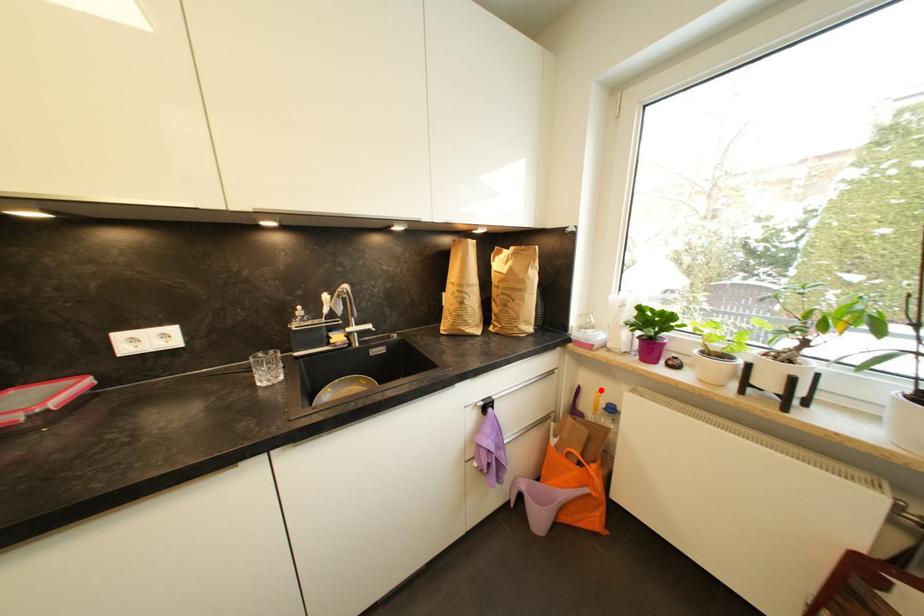
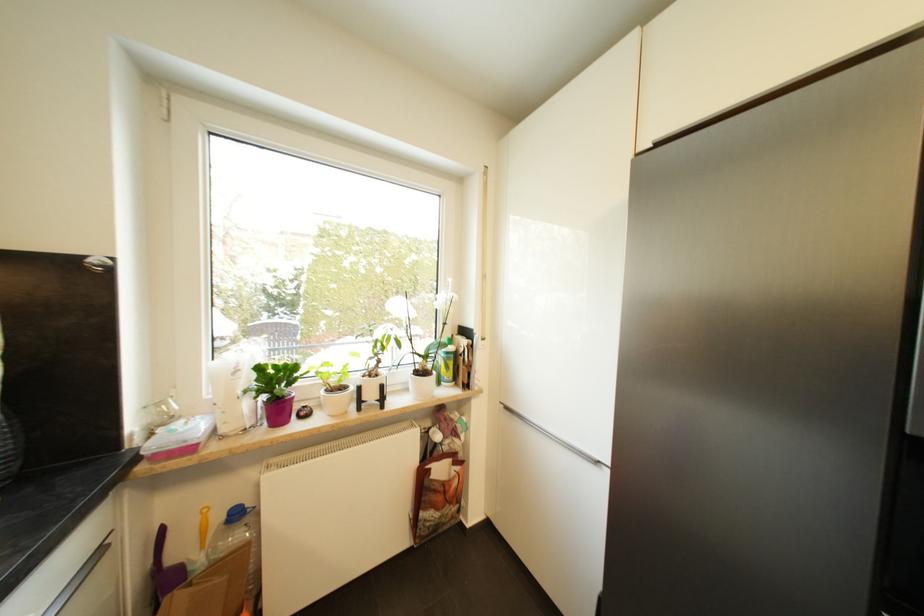
Where in the second image is the point corresponding to the highlighted location from the first image?

(207, 507)